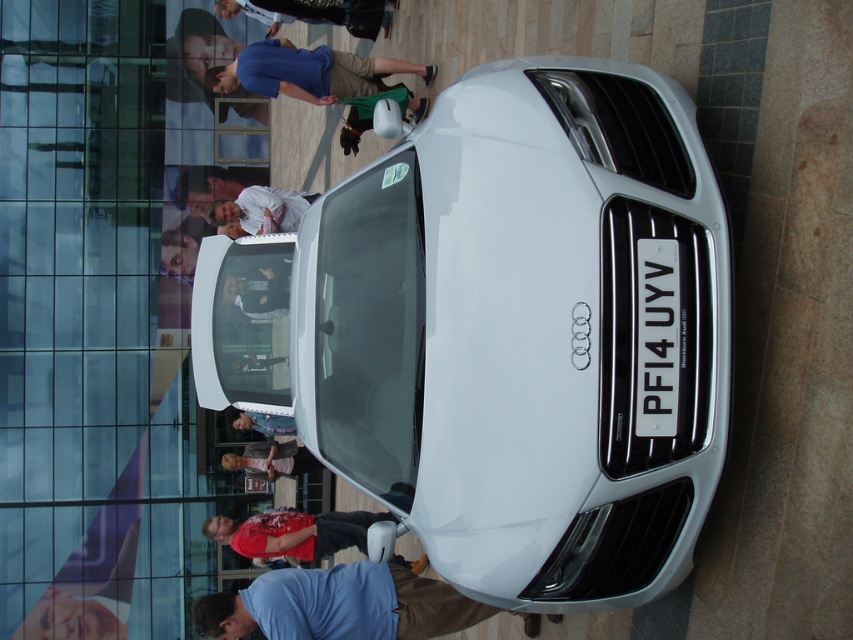
How far apart are smooth skin hand at lower center and red t-shirt at lower center?

smooth skin hand at lower center and red t-shirt at lower center are 75.05 feet apart from each other.

Between smooth skin hand at lower center and red t-shirt at lower center, which one appears on the right side from the viewer's perspective?

red t-shirt at lower center is more to the right.

Locate an element on the screen. This screenshot has width=853, height=640. smooth skin hand at lower center is located at coordinates (85, 602).

Does white glossy car at center have a greater height compared to blue fabric shirt at lower center?

Yes.

Is point (358, 378) positioned after point (206, 616)?

No, (358, 378) is in front of (206, 616).

What are the coordinates of `white glossy car at center` in the screenshot? It's located at (527, 332).

Can you confirm if white cotton shirt at center is positioned above blue denim jeans at center?

Yes, white cotton shirt at center is above blue denim jeans at center.

Is white cotton shirt at center further to the viewer compared to blue denim jeans at center?

Yes, white cotton shirt at center is further from the viewer.

This screenshot has width=853, height=640. I want to click on white cotton shirt at center, so click(259, 211).

Where is `white cotton shirt at center`? This screenshot has height=640, width=853. white cotton shirt at center is located at coordinates (259, 211).